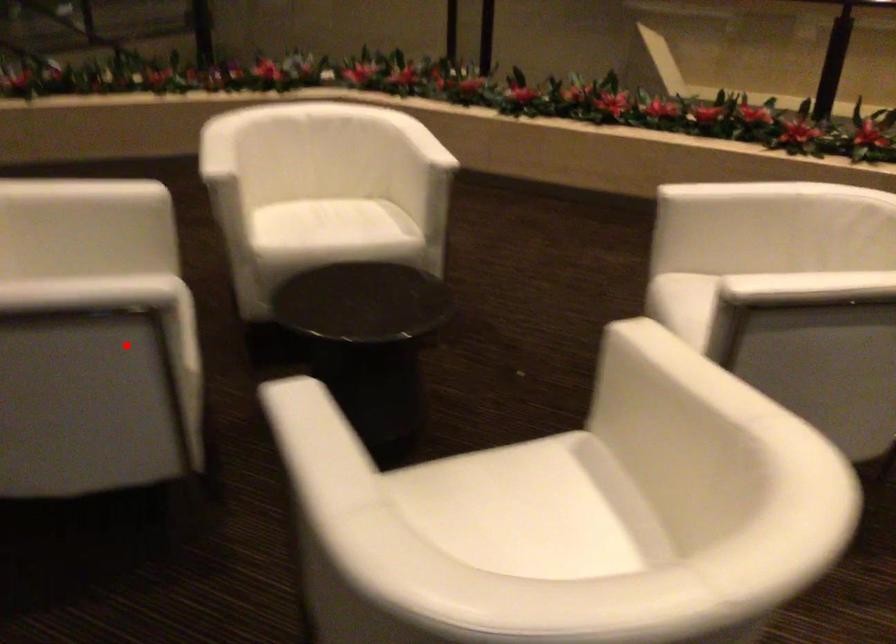
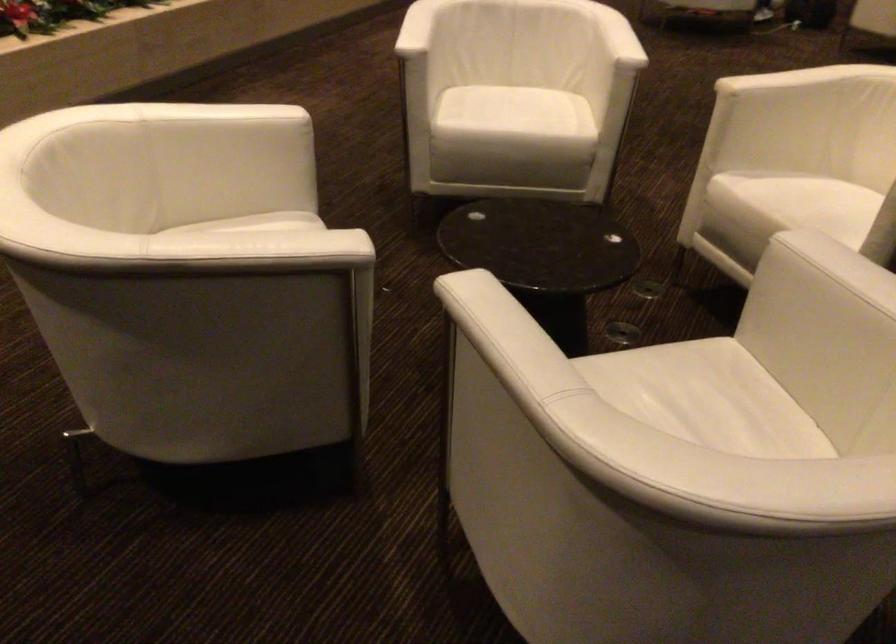
Question: A red point is marked in image1. In image2, is the corresponding 3D point closer to the camera or farther? Reply with the corresponding letter.

Choices:
 (A) The corresponding 3D point is closer.
 (B) The corresponding 3D point is farther.

Answer: (A)